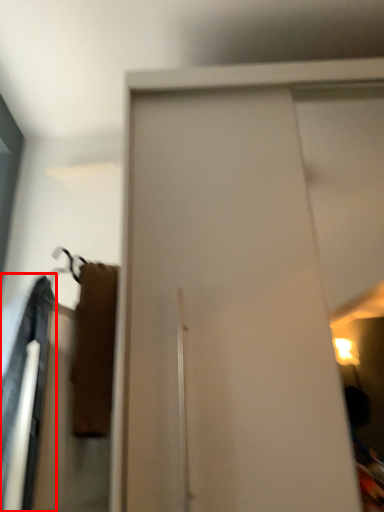
Question: From the image, what is the correct spatial relationship of robe (annotated by the red box) in relation to screen door?

Choices:
 (A) left
 (B) right

Answer: (A)